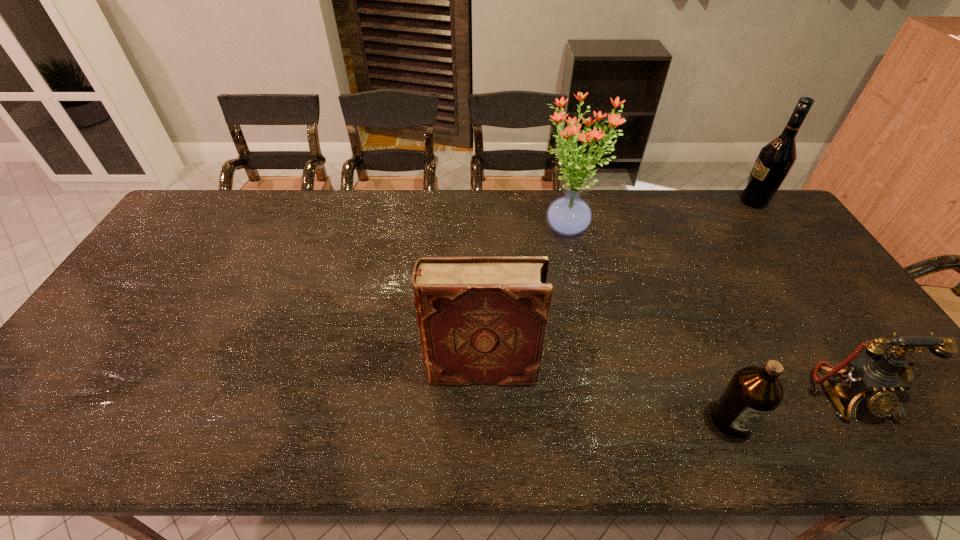
What are the coordinates of `vacant space located 0.390m on the spine side of the hardback book` in the screenshot? It's located at (268, 369).

You are a GUI agent. You are given a task and a screenshot of the screen. Output one action in this format:
    pyautogui.click(x=<x>, y=<y>)
    Task: Click on the vacant space located on the spine side of the hardback book
    
    Given the screenshot: What is the action you would take?
    pos(385,369)

At what (x,y) coordinates should I click in order to perform the action: click on vacant area located on the front of the telephone, featuring the rotary dial. Please return your answer as a coordinate pair (x, y). This screenshot has height=540, width=960. Looking at the image, I should click on pos(885,451).

The width and height of the screenshot is (960, 540). In order to click on flower arrangement that is at the far edge in this screenshot , I will do `click(569, 215)`.

The image size is (960, 540). In order to click on wine bottle at the far edge in this screenshot , I will do `click(775, 160)`.

Where is `telephone situated at the near edge`? This screenshot has width=960, height=540. telephone situated at the near edge is located at coordinates (877, 378).

The image size is (960, 540). Find the location of `olive oil located in the near edge section of the desktop`. olive oil located in the near edge section of the desktop is located at coordinates (753, 393).

The image size is (960, 540). In order to click on wine bottle located in the right edge section of the desktop in this screenshot , I will do `click(775, 160)`.

The height and width of the screenshot is (540, 960). What are the coordinates of `telephone that is at the right edge` in the screenshot? It's located at (877, 378).

This screenshot has width=960, height=540. In order to click on object that is at the far right corner in this screenshot , I will do `click(775, 160)`.